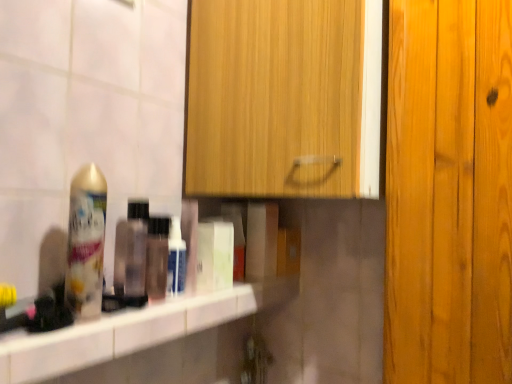
Locate an element on the screen. This screenshot has height=384, width=512. white glossy bottle at center, arranged as the 2th mouthwash when viewed from the left is located at coordinates (176, 259).

Locate an element on the screen. The height and width of the screenshot is (384, 512). gold metallic can at left is located at coordinates (86, 242).

I want to click on translucent plastic bottle at center, so coord(157,257).

Locate an element on the screen. The width and height of the screenshot is (512, 384). wooden cabinet at upper center is located at coordinates (284, 98).

Is white glossy bottle at center, the 1th mouthwash from the right, in front of translucent plastic bottle at shelf, the first mouthwash in the left-to-right sequence?

No, white glossy bottle at center, the 1th mouthwash from the right, is behind translucent plastic bottle at shelf, the first mouthwash in the left-to-right sequence.

Can you confirm if white glossy bottle at center, the 1th mouthwash from the right, is taller than translucent plastic bottle at shelf, marked as the 2th mouthwash in a right-to-left arrangement?

Incorrect, the height of white glossy bottle at center, the 1th mouthwash from the right, is not larger of that of translucent plastic bottle at shelf, marked as the 2th mouthwash in a right-to-left arrangement.

From the image's perspective, which object appears higher, white glossy bottle at center, the 1th mouthwash from the right, or translucent plastic bottle at shelf, marked as the 2th mouthwash in a right-to-left arrangement?

translucent plastic bottle at shelf, marked as the 2th mouthwash in a right-to-left arrangement, is shown above in the image.

Is white glossy bottle at center, the 1th mouthwash from the right, far away from translucent plastic bottle at shelf, the first mouthwash in the left-to-right sequence?

No.

Between point (133, 245) and point (193, 330), which one is positioned in front?

The point (193, 330) is closer.

Would you consider translucent plastic bottle at shelf, the first mouthwash in the left-to-right sequence, to be distant from white glossy counter top at center?

Actually, translucent plastic bottle at shelf, the first mouthwash in the left-to-right sequence, and white glossy counter top at center are a little close together.

From a real-world perspective, who is located lower, translucent plastic bottle at shelf, marked as the 2th mouthwash in a right-to-left arrangement, or white glossy counter top at center?

From a 3D spatial view, white glossy counter top at center is below.

How many degrees apart are the facing directions of translucent plastic bottle at shelf, marked as the 2th mouthwash in a right-to-left arrangement, and white glossy counter top at center?

translucent plastic bottle at shelf, marked as the 2th mouthwash in a right-to-left arrangement, and white glossy counter top at center are facing 0.276 degrees away from each other.

Is point (173, 287) farther from camera compared to point (96, 299)?

Yes.

Could you tell me if white glossy bottle at center, the 1th mouthwash from the right, is facing gold metallic can at left?

No, white glossy bottle at center, the 1th mouthwash from the right, is not oriented towards gold metallic can at left.

Between white glossy bottle at center, the 1th mouthwash from the right, and gold metallic can at left, which one has larger size?

Bigger between the two is gold metallic can at left.

Based on their positions, is white glossy bottle at center, arranged as the 2th mouthwash when viewed from the left, located to the left or right of gold metallic can at left?

white glossy bottle at center, arranged as the 2th mouthwash when viewed from the left, is to the right of gold metallic can at left.

Considering the relative sizes of white glossy counter top at center and wooden cabinet at upper center in the image provided, is white glossy counter top at center thinner than wooden cabinet at upper center?

Yes, white glossy counter top at center is thinner than wooden cabinet at upper center.

Which is closer to the camera, (x=206, y=317) or (x=273, y=184)?

The point (x=206, y=317) is more forward.

From the image's perspective, which is below, white glossy counter top at center or wooden cabinet at upper center?

white glossy counter top at center.

In the scene shown: In terms of height, does white glossy counter top at center look taller or shorter compared to wooden cabinet at upper center?

Considering their sizes, white glossy counter top at center has less height than wooden cabinet at upper center.

Is point (140, 207) positioned in front of point (166, 257)?

That is True.

Between translucent plastic bottle at shelf, marked as the 2th mouthwash in a right-to-left arrangement, and translucent plastic bottle at center, which one has more height?

translucent plastic bottle at shelf, marked as the 2th mouthwash in a right-to-left arrangement, is taller.

Are translucent plastic bottle at shelf, marked as the 2th mouthwash in a right-to-left arrangement, and translucent plastic bottle at center far apart?

No.

From the image's perspective, would you say translucent plastic bottle at shelf, marked as the 2th mouthwash in a right-to-left arrangement, is shown under translucent plastic bottle at center?

Actually, translucent plastic bottle at shelf, marked as the 2th mouthwash in a right-to-left arrangement, appears above translucent plastic bottle at center in the image.

From the image's perspective, which one is positioned lower, translucent plastic bottle at shelf, the first mouthwash in the left-to-right sequence, or white glossy bottle at center, the 1th mouthwash from the right?

white glossy bottle at center, the 1th mouthwash from the right, appears lower in the image.

Which is more to the right, translucent plastic bottle at shelf, the first mouthwash in the left-to-right sequence, or white glossy bottle at center, arranged as the 2th mouthwash when viewed from the left?

white glossy bottle at center, arranged as the 2th mouthwash when viewed from the left, is more to the right.

Who is taller, translucent plastic bottle at shelf, the first mouthwash in the left-to-right sequence, or white glossy bottle at center, the 1th mouthwash from the right?

translucent plastic bottle at shelf, the first mouthwash in the left-to-right sequence.

Is translucent plastic bottle at shelf, the first mouthwash in the left-to-right sequence, positioned far away from white glossy bottle at center, the 1th mouthwash from the right?

No.

Is translucent plastic bottle at center smaller than wooden cabinet at upper center?

Correct, translucent plastic bottle at center occupies less space than wooden cabinet at upper center.

Which object is positioned more to the left, translucent plastic bottle at center or wooden cabinet at upper center?

From the viewer's perspective, translucent plastic bottle at center appears more on the left side.

Which is behind, point (160, 246) or point (211, 14)?

The point (211, 14) is farther.

In the image, is translucent plastic bottle at center positioned in front of or behind wooden cabinet at upper center?

Clearly, translucent plastic bottle at center is behind wooden cabinet at upper center.

Identify the location of mouthwash in front of the white glossy bottle at center, arranged as the 2th mouthwash when viewed from the left. (132, 254).

There is a white glossy counter top at center. Identify the location of the 2nd mouthwash above it (from a real-world perspective). The width and height of the screenshot is (512, 384). (132, 254).

From the image, which object appears to be farther from translucent plastic bottle at center, white glossy counter top at center or gold metallic can at left?

gold metallic can at left is positioned further to the anchor translucent plastic bottle at center.

Estimate the real-world distances between objects in this image. Which object is closer to translucent plastic bottle at shelf, marked as the 2th mouthwash in a right-to-left arrangement, translucent plastic bottle at center or white glossy counter top at center?

translucent plastic bottle at center lies closer to translucent plastic bottle at shelf, marked as the 2th mouthwash in a right-to-left arrangement, than the other object.

Consider the image. When comparing their distances from translucent plastic bottle at center, does translucent plastic bottle at shelf, marked as the 2th mouthwash in a right-to-left arrangement, or gold metallic can at left seem further?

Based on the image, gold metallic can at left appears to be further to translucent plastic bottle at center.

Which object lies further to the anchor point white glossy counter top at center, translucent plastic bottle at center or wooden cabinet at upper center?

The object further to white glossy counter top at center is wooden cabinet at upper center.

From the picture: Based on their spatial positions, is white glossy bottle at center, arranged as the 2th mouthwash when viewed from the left, or translucent plastic bottle at shelf, marked as the 2th mouthwash in a right-to-left arrangement, further from wooden cabinet at upper center?

Among the two, translucent plastic bottle at shelf, marked as the 2th mouthwash in a right-to-left arrangement, is located further to wooden cabinet at upper center.

Considering their positions, is white glossy bottle at center, the 1th mouthwash from the right, positioned further to translucent plastic bottle at center than white glossy counter top at center?

Based on the image, white glossy counter top at center appears to be further to translucent plastic bottle at center.

In the scene shown: From the image, which object appears to be farther from translucent plastic bottle at center, translucent plastic bottle at shelf, the first mouthwash in the left-to-right sequence, or white glossy bottle at center, arranged as the 2th mouthwash when viewed from the left?

Based on the image, white glossy bottle at center, arranged as the 2th mouthwash when viewed from the left, appears to be further to translucent plastic bottle at center.

Considering their positions, is gold metallic can at left positioned closer to translucent plastic bottle at center than white glossy counter top at center?

white glossy counter top at center.

The image size is (512, 384). Find the location of `shaving cream located between white glossy counter top at center and translucent plastic bottle at center in the depth direction`. shaving cream located between white glossy counter top at center and translucent plastic bottle at center in the depth direction is located at coordinates (86, 242).

The image size is (512, 384). I want to click on bottle located between white glossy counter top at center and white glossy bottle at center, the 1th mouthwash from the right, in the depth direction, so click(x=157, y=257).

Where is `shaving cream located between white glossy counter top at center and translucent plastic bottle at shelf, the first mouthwash in the left-to-right sequence, in the depth direction`? This screenshot has width=512, height=384. shaving cream located between white glossy counter top at center and translucent plastic bottle at shelf, the first mouthwash in the left-to-right sequence, in the depth direction is located at coordinates (86, 242).

What are the coordinates of `shaving cream between wooden cabinet at upper center and white glossy bottle at center, the 1th mouthwash from the right, from top to bottom` in the screenshot? It's located at (86, 242).